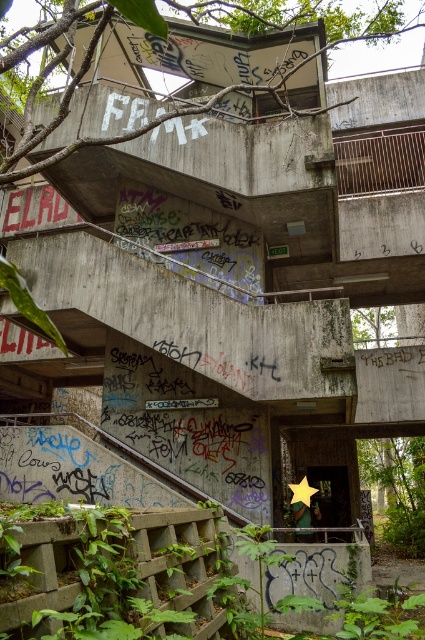
You are a maintenance worker needing to inspect the vegetation between the green leafy plants at lower left and the green leafy vegetation at lower right. Given that your ladder is 30 feet long, can you safely reach the area between them without needing a longer ladder?

The distance between the green leafy plants at lower left and the green leafy vegetation at lower right is 42.87 feet. Since your ladder is only 30 feet long, it is not long enough to safely bridge the gap between them. You will need a ladder that is at least 42.87 feet in length to cover the distance.

You are a botanist examining the abandoned structure. You notice two areas with green leafy plants at lower left and green leafy vegetation at lower right. Which area has a wider spread of vegetation?

The green leafy vegetation at lower right has a wider spread than the green leafy plants at lower left.